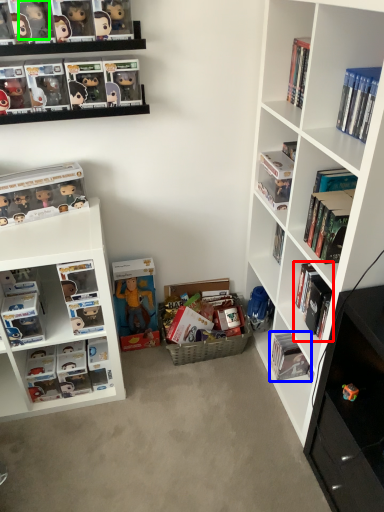
Question: Which object is the closest to the book (highlighted by a red box)? Choose among these: book (highlighted by a blue box) or toy (highlighted by a green box).

Choices:
 (A) book
 (B) toy

Answer: (A)